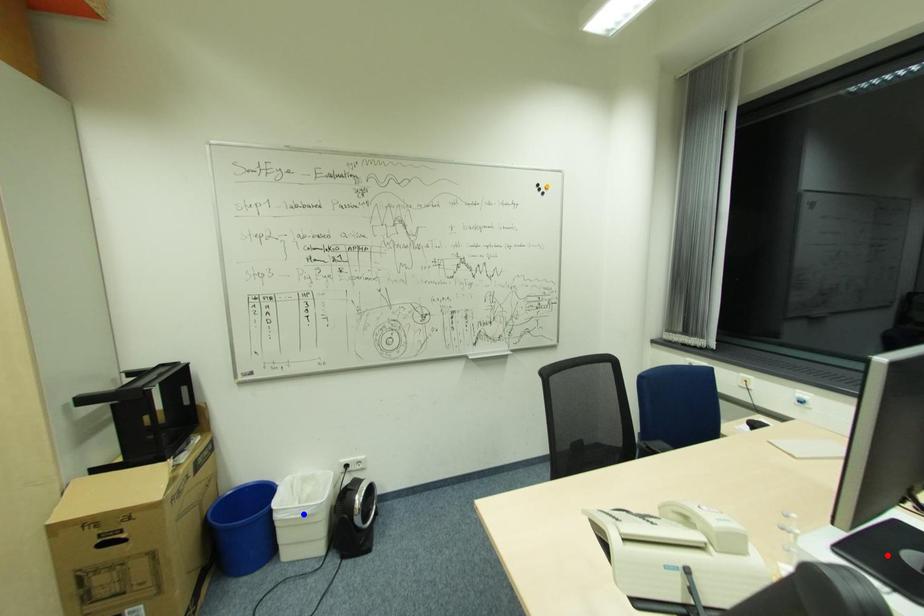
Question: In the image, two points are highlighted. Which point is nearer to the camera? Reply with the corresponding letter.

Choices:
 (A) blue point
 (B) red point

Answer: (B)